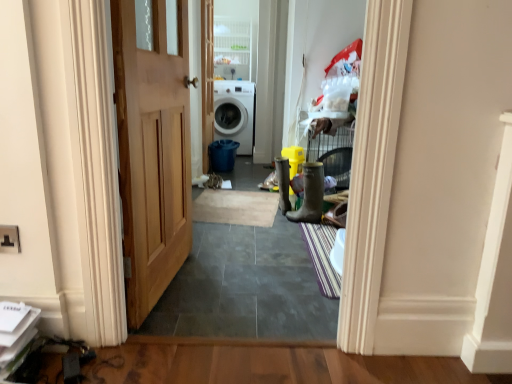
Where is `vacant location below beige carpet at center, marked as the first doormat in a top-to-bottom arrangement (from a real-world perspective)`? vacant location below beige carpet at center, marked as the first doormat in a top-to-bottom arrangement (from a real-world perspective) is located at coordinates (238, 206).